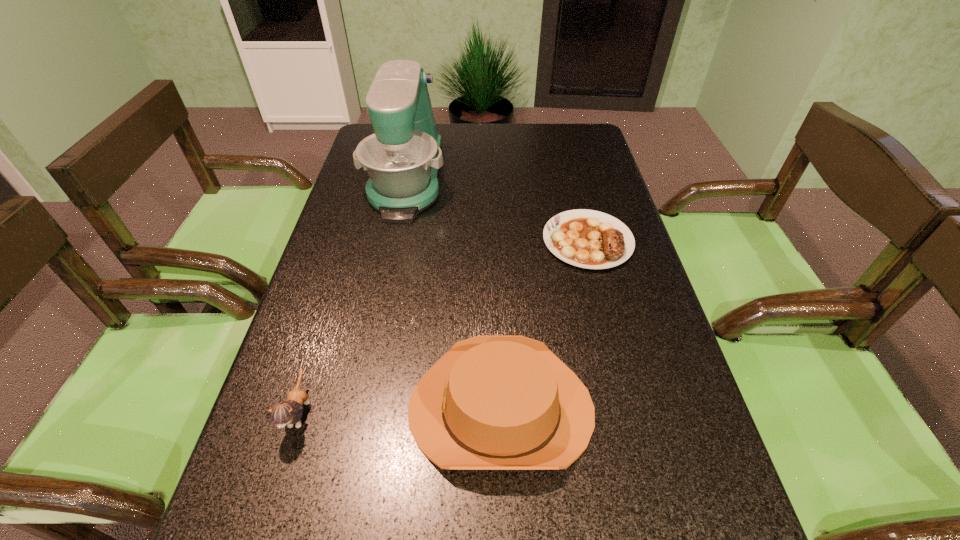
Where is `the tallest object`? This screenshot has height=540, width=960. the tallest object is located at coordinates (402, 157).

Identify the location of cowboy hat. (493, 402).

Where is `kitten`? Image resolution: width=960 pixels, height=540 pixels. kitten is located at coordinates (289, 412).

Where is `steak`? steak is located at coordinates (590, 239).

In order to click on free space located 0.320m on the front-facing side of the tallest object in this screenshot , I will do `click(378, 317)`.

At what (x,y) coordinates should I click in order to perform the action: click on vacant space situated on the front-facing side of the cowboy hat. Please return your answer as a coordinate pair (x, y). This screenshot has height=540, width=960. Looking at the image, I should click on (x=337, y=409).

At what (x,y) coordinates should I click in order to perform the action: click on vacant space located 0.210m on the front-facing side of the cowboy hat. Please return your answer as a coordinate pair (x, y). This screenshot has width=960, height=540. Looking at the image, I should click on (294, 409).

Locate an element on the screen. free space located 0.180m on the front-facing side of the cowboy hat is located at coordinates (310, 409).

Where is `vacant space located 0.050m on the front-facing side of the kitten`? Image resolution: width=960 pixels, height=540 pixels. vacant space located 0.050m on the front-facing side of the kitten is located at coordinates (280, 475).

I want to click on free space located on the left of the shortest object, so click(x=398, y=241).